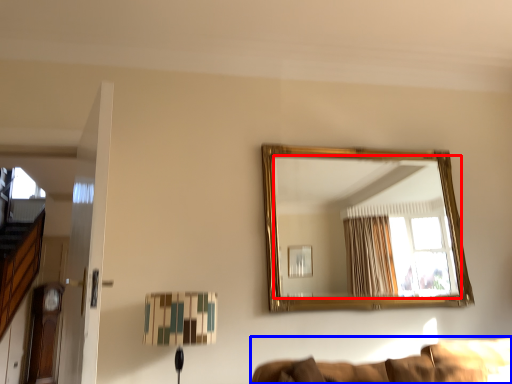
Question: Among these objects, which one is nearest to the camera, mirror (highlighted by a red box) or couch (highlighted by a blue box)?

Choices:
 (A) mirror
 (B) couch

Answer: (B)